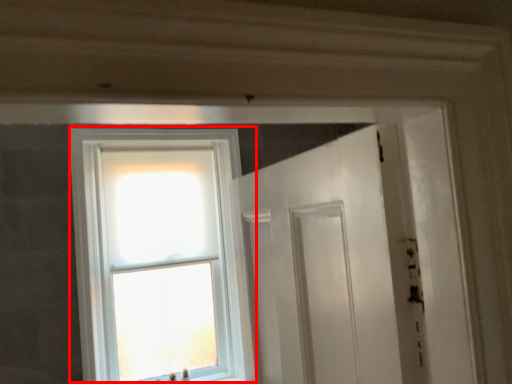
Question: Considering the relative positions of window (annotated by the red box) and screen door in the image provided, where is window (annotated by the red box) located with respect to the staircase?

Choices:
 (A) right
 (B) left

Answer: (B)